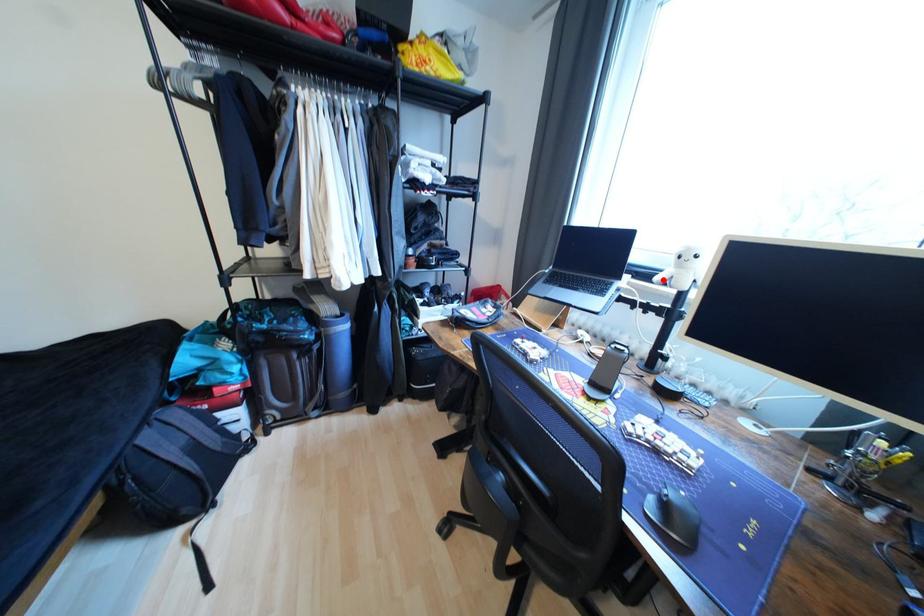
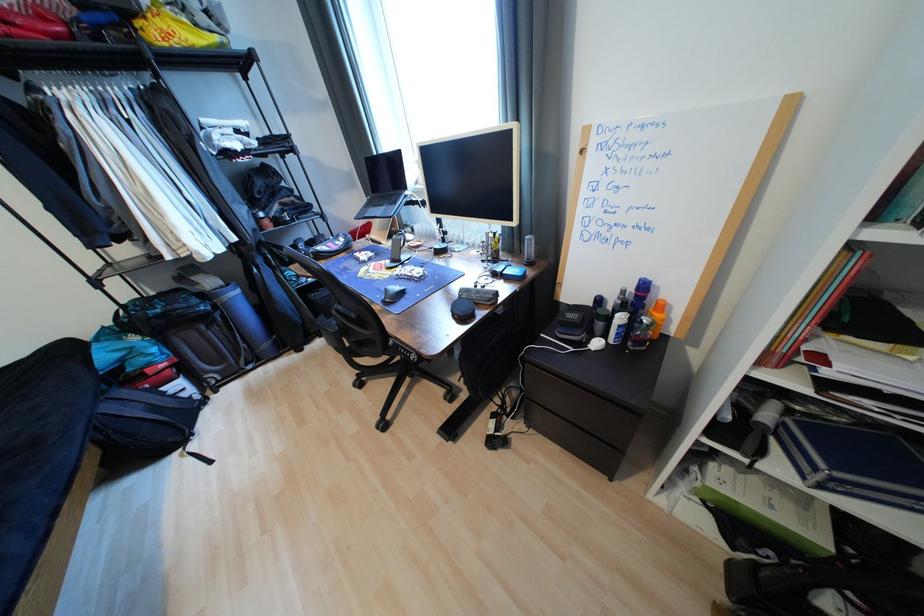
Question: I am providing you with two images of the same scene from different viewpoints. A red point is marked on the first image. Is the red point's position out of view in image 2?

Choices:
 (A) Yes
 (B) No

Answer: (A)